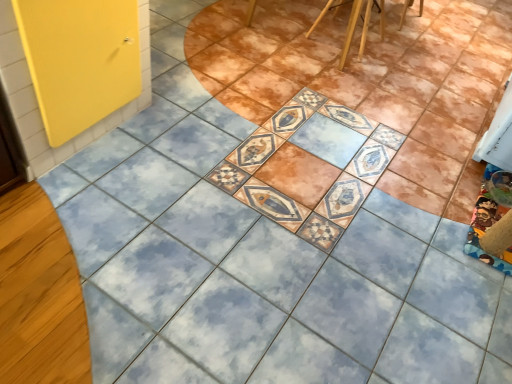
In order to click on yellow matte door at left in this screenshot , I will do coord(80,60).

What do you see at coordinates (80, 60) in the screenshot? I see `yellow matte door at left` at bounding box center [80, 60].

The height and width of the screenshot is (384, 512). Describe the element at coordinates (405, 12) in the screenshot. I see `wooden chair at upper center` at that location.

This screenshot has width=512, height=384. I want to click on yellow matte door at left, so click(x=80, y=60).

Which is behind, yellow matte door at left or wooden chair at upper center?

wooden chair at upper center.

Is yellow matte door at left oriented towards wooden chair at upper center?

Yes, yellow matte door at left is facing wooden chair at upper center.

Which of these two, yellow matte door at left or wooden chair at upper center, stands taller?

With more height is yellow matte door at left.

Is yellow matte door at left next to wooden chair at upper center and touching it?

yellow matte door at left and wooden chair at upper center are not in contact.

Based on their sizes in the image, would you say yellow matte door at left is bigger or smaller than wooden chair at upper center?

yellow matte door at left is bigger than wooden chair at upper center.

What's the angular difference between yellow matte door at left and wooden chair at upper center's facing directions?

The angle between the facing direction of yellow matte door at left and the facing direction of wooden chair at upper center is 179 degrees.

From the image's perspective, is yellow matte door at left over wooden chair at upper center?

Actually, yellow matte door at left appears below wooden chair at upper center in the image.

Can you confirm if wooden chair at upper center is positioned to the right of wooden chair at upper center?

Yes.

Is wooden chair at upper center not near wooden chair at upper center?

Actually, wooden chair at upper center and wooden chair at upper center are a little close together.

Is wooden chair at upper center closer to the viewer compared to wooden chair at upper center?

That is False.

Locate an element on the screen. chair behind the wooden chair at upper center is located at coordinates (405, 12).

Is wooden chair at upper center smaller than yellow matte door at left?

Correct, wooden chair at upper center occupies less space than yellow matte door at left.

Is wooden chair at upper center next to yellow matte door at left?

No, wooden chair at upper center is not next to yellow matte door at left.

Between wooden chair at upper center and yellow matte door at left, which one has smaller width?

With smaller width is wooden chair at upper center.

Measure the distance between wooden chair at upper center and yellow matte door at left.

wooden chair at upper center is 2.13 meters away from yellow matte door at left.

Can you confirm if wooden chair at upper center is smaller than yellow matte door at left?

Yes.

Between wooden chair at upper center and yellow matte door at left, which one has smaller width?

Thinner between the two is yellow matte door at left.

From a real-world perspective, who is located lower, wooden chair at upper center or yellow matte door at left?

In real-world perspective, wooden chair at upper center is lower.

Could you tell me if wooden chair at upper center is facing yellow matte door at left?

Yes, wooden chair at upper center is oriented towards yellow matte door at left.

From the image's perspective, which is below, wooden chair at upper center or wooden chair at upper center?

wooden chair at upper center is shown below in the image.

Measure the distance from wooden chair at upper center to wooden chair at upper center.

wooden chair at upper center and wooden chair at upper center are 12.64 centimeters apart.

From the picture: Is wooden chair at upper center far from wooden chair at upper center?

No, there isn't a large distance between wooden chair at upper center and wooden chair at upper center.

Based on their positions, is wooden chair at upper center located to the left or right of wooden chair at upper center?

Based on their positions, wooden chair at upper center is located to the left of wooden chair at upper center.

Find the location of a particular element. Image resolution: width=512 pixels, height=384 pixels. chair below the yellow matte door at left (from a real-world perspective) is located at coordinates (405, 12).

This screenshot has height=384, width=512. I want to click on screen door below the wooden chair at upper center (from the image's perspective), so click(80, 60).

Based on their spatial positions, is wooden chair at upper center or wooden chair at upper center further from yellow matte door at left?

wooden chair at upper center is further to yellow matte door at left.

Consider the image. When comparing their distances from wooden chair at upper center, does wooden chair at upper center or yellow matte door at left seem further?

The object further to wooden chair at upper center is yellow matte door at left.

From the image, which object appears to be farther from wooden chair at upper center, wooden chair at upper center or yellow matte door at left?

yellow matte door at left is positioned further to the anchor wooden chair at upper center.

Looking at the image, which one is located closer to wooden chair at upper center, yellow matte door at left or wooden chair at upper center?

Based on the image, wooden chair at upper center appears to be nearer to wooden chair at upper center.

Which object lies nearer to the anchor point wooden chair at upper center, yellow matte door at left or wooden chair at upper center?

wooden chair at upper center is positioned closer to the anchor wooden chair at upper center.

Considering their positions, is wooden chair at upper center positioned closer to yellow matte door at left than wooden chair at upper center?

The object closer to yellow matte door at left is wooden chair at upper center.

Image resolution: width=512 pixels, height=384 pixels. I want to click on furniture between yellow matte door at left and wooden chair at upper center from left to right, so click(354, 22).